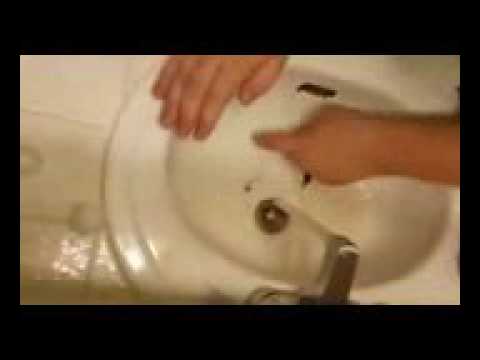
The image size is (480, 360). What are the coordinates of `faucet` in the screenshot? It's located at (x=346, y=273).